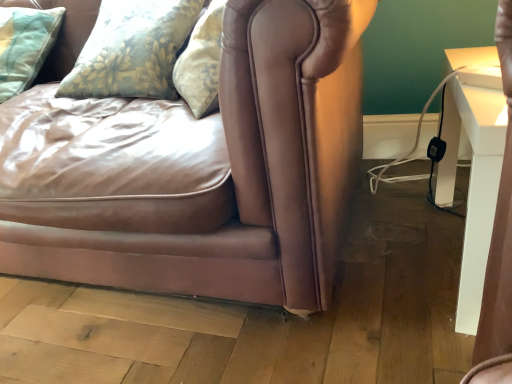
The width and height of the screenshot is (512, 384). Describe the element at coordinates (132, 50) in the screenshot. I see `floral fabric pillow at upper left, arranged as the second pillow when viewed from the left` at that location.

Measure the distance between matte brown leather couch at center and camera.

21.94 inches.

I want to click on white glossy table at right, so click(473, 180).

Which pillow is the 1st one when counting from the back of the white glossy table at right? Please provide its 2D coordinates.

[(132, 50)]

From a real-world perspective, who is located lower, white glossy table at right or floral fabric pillow at upper left, which is the 1th pillow from right to left?

white glossy table at right is physically lower.

Does white glossy table at right have a lesser height compared to floral fabric pillow at upper left, arranged as the second pillow when viewed from the left?

No, white glossy table at right is not shorter than floral fabric pillow at upper left, arranged as the second pillow when viewed from the left.

In the image, is matte brown leather couch at center positioned in front of or behind light blue quilted pillow at upper left, acting as the first pillow starting from the left?

matte brown leather couch at center is in front of light blue quilted pillow at upper left, acting as the first pillow starting from the left.

From a real-world perspective, is matte brown leather couch at center positioned under light blue quilted pillow at upper left, acting as the second pillow starting from the right, based on gravity?

Indeed, from a real-world perspective, matte brown leather couch at center is positioned beneath light blue quilted pillow at upper left, acting as the second pillow starting from the right.

Where is `pillow on the left of matte brown leather couch at center`? This screenshot has height=384, width=512. pillow on the left of matte brown leather couch at center is located at coordinates (25, 45).

Is matte brown leather couch at center inside floral fabric pillow at upper left, arranged as the second pillow when viewed from the left?

No, floral fabric pillow at upper left, arranged as the second pillow when viewed from the left, does not contain matte brown leather couch at center.

How many degrees apart are the facing directions of floral fabric pillow at upper left, arranged as the second pillow when viewed from the left, and matte brown leather couch at center?

There is a 3.27-degree angle between the facing directions of floral fabric pillow at upper left, arranged as the second pillow when viewed from the left, and matte brown leather couch at center.

Does point (170, 32) lie in front of point (181, 214)?

No, it is not.

Is floral fabric pillow at upper left, arranged as the second pillow when viewed from the left, at the left side of matte brown leather couch at center?

In fact, floral fabric pillow at upper left, arranged as the second pillow when viewed from the left, is to the right of matte brown leather couch at center.

Is point (38, 71) less distant than point (262, 266)?

That is False.

Is light blue quilted pillow at upper left, acting as the second pillow starting from the right, in front of matte brown leather couch at center?

No, light blue quilted pillow at upper left, acting as the second pillow starting from the right, is behind matte brown leather couch at center.

Does light blue quilted pillow at upper left, acting as the first pillow starting from the left, have a lesser height compared to matte brown leather couch at center?

Yes, light blue quilted pillow at upper left, acting as the first pillow starting from the left, is shorter than matte brown leather couch at center.

Could you tell me if light blue quilted pillow at upper left, acting as the first pillow starting from the left, is facing matte brown leather couch at center?

Yes, light blue quilted pillow at upper left, acting as the first pillow starting from the left, is oriented towards matte brown leather couch at center.

Where is `table below the matte brown leather couch at center (from a real-world perspective)`? table below the matte brown leather couch at center (from a real-world perspective) is located at coordinates (473, 180).

Considering the relative sizes of white glossy table at right and matte brown leather couch at center in the image provided, is white glossy table at right taller than matte brown leather couch at center?

In fact, white glossy table at right may be shorter than matte brown leather couch at center.

Is the position of white glossy table at right less distant than that of matte brown leather couch at center?

No, it is behind matte brown leather couch at center.

Is white glossy table at right bigger than matte brown leather couch at center?

Actually, white glossy table at right might be smaller than matte brown leather couch at center.

What's the angular difference between light blue quilted pillow at upper left, acting as the first pillow starting from the left, and floral fabric pillow at upper left, arranged as the second pillow when viewed from the left,'s facing directions?

They differ by 9.47 degrees in their facing directions.

In terms of width, does light blue quilted pillow at upper left, acting as the first pillow starting from the left, look wider or thinner when compared to floral fabric pillow at upper left, arranged as the second pillow when viewed from the left?

In the image, light blue quilted pillow at upper left, acting as the first pillow starting from the left, appears to be more narrow than floral fabric pillow at upper left, arranged as the second pillow when viewed from the left.

Considering the positions of objects light blue quilted pillow at upper left, acting as the second pillow starting from the right, and floral fabric pillow at upper left, which is the 1th pillow from right to left, in the image provided, who is more to the right, light blue quilted pillow at upper left, acting as the second pillow starting from the right, or floral fabric pillow at upper left, which is the 1th pillow from right to left,?

floral fabric pillow at upper left, which is the 1th pillow from right to left.

How distant is light blue quilted pillow at upper left, acting as the first pillow starting from the left, from floral fabric pillow at upper left, which is the 1th pillow from right to left?

A distance of 13.86 inches exists between light blue quilted pillow at upper left, acting as the first pillow starting from the left, and floral fabric pillow at upper left, which is the 1th pillow from right to left.

Does white glossy table at right turn towards light blue quilted pillow at upper left, acting as the second pillow starting from the right?

No, white glossy table at right is not facing towards light blue quilted pillow at upper left, acting as the second pillow starting from the right.

Can you confirm if white glossy table at right is wider than light blue quilted pillow at upper left, acting as the first pillow starting from the left?

Incorrect, the width of white glossy table at right does not surpass that of light blue quilted pillow at upper left, acting as the first pillow starting from the left.

Is white glossy table at right in front of or behind light blue quilted pillow at upper left, acting as the first pillow starting from the left, in the image?

In the image, white glossy table at right appears in front of light blue quilted pillow at upper left, acting as the first pillow starting from the left.

From a real-world perspective, does white glossy table at right sit lower than light blue quilted pillow at upper left, acting as the first pillow starting from the left?

Yes, from a real-world perspective, white glossy table at right is under light blue quilted pillow at upper left, acting as the first pillow starting from the left.

Where is `the 1st pillow behind the white glossy table at right`? the 1st pillow behind the white glossy table at right is located at coordinates (132, 50).

The image size is (512, 384). In order to click on studio couch on the right of light blue quilted pillow at upper left, acting as the first pillow starting from the left in this screenshot , I will do `click(205, 170)`.

Which object lies further to the anchor point matte brown leather couch at center, light blue quilted pillow at upper left, acting as the second pillow starting from the right, or white glossy table at right?

light blue quilted pillow at upper left, acting as the second pillow starting from the right.

Considering their positions, is white glossy table at right positioned further to matte brown leather couch at center than floral fabric pillow at upper left, which is the 1th pillow from right to left?

Based on the image, white glossy table at right appears to be further to matte brown leather couch at center.

In the scene shown: When comparing their distances from floral fabric pillow at upper left, arranged as the second pillow when viewed from the left, does matte brown leather couch at center or white glossy table at right seem closer?

Based on the image, matte brown leather couch at center appears to be nearer to floral fabric pillow at upper left, arranged as the second pillow when viewed from the left.

Based on the photo, based on their spatial positions, is light blue quilted pillow at upper left, acting as the first pillow starting from the left, or floral fabric pillow at upper left, which is the 1th pillow from right to left, closer to white glossy table at right?

Based on the image, floral fabric pillow at upper left, which is the 1th pillow from right to left, appears to be nearer to white glossy table at right.

Estimate the real-world distances between objects in this image. Which object is further from light blue quilted pillow at upper left, acting as the second pillow starting from the right, white glossy table at right or floral fabric pillow at upper left, which is the 1th pillow from right to left?

white glossy table at right is positioned further to the anchor light blue quilted pillow at upper left, acting as the second pillow starting from the right.

Considering their positions, is matte brown leather couch at center positioned closer to light blue quilted pillow at upper left, acting as the second pillow starting from the right, than floral fabric pillow at upper left, which is the 1th pillow from right to left?

Among the two, floral fabric pillow at upper left, which is the 1th pillow from right to left, is located nearer to light blue quilted pillow at upper left, acting as the second pillow starting from the right.

When comparing their distances from floral fabric pillow at upper left, arranged as the second pillow when viewed from the left, does white glossy table at right or matte brown leather couch at center seem closer?

matte brown leather couch at center is closer to floral fabric pillow at upper left, arranged as the second pillow when viewed from the left.

Looking at the image, which one is located closer to light blue quilted pillow at upper left, acting as the second pillow starting from the right, white glossy table at right or matte brown leather couch at center?

matte brown leather couch at center lies closer to light blue quilted pillow at upper left, acting as the second pillow starting from the right, than the other object.

In order to click on pillow located between matte brown leather couch at center and white glossy table at right in the left-right direction in this screenshot , I will do `click(132, 50)`.

Where is `pillow between matte brown leather couch at center and light blue quilted pillow at upper left, acting as the second pillow starting from the right, in the front-back direction`? pillow between matte brown leather couch at center and light blue quilted pillow at upper left, acting as the second pillow starting from the right, in the front-back direction is located at coordinates (132, 50).

The image size is (512, 384). In order to click on studio couch between light blue quilted pillow at upper left, acting as the first pillow starting from the left, and white glossy table at right from left to right in this screenshot , I will do `click(205, 170)`.

This screenshot has width=512, height=384. I want to click on pillow between light blue quilted pillow at upper left, acting as the first pillow starting from the left, and white glossy table at right from left to right, so click(x=132, y=50).